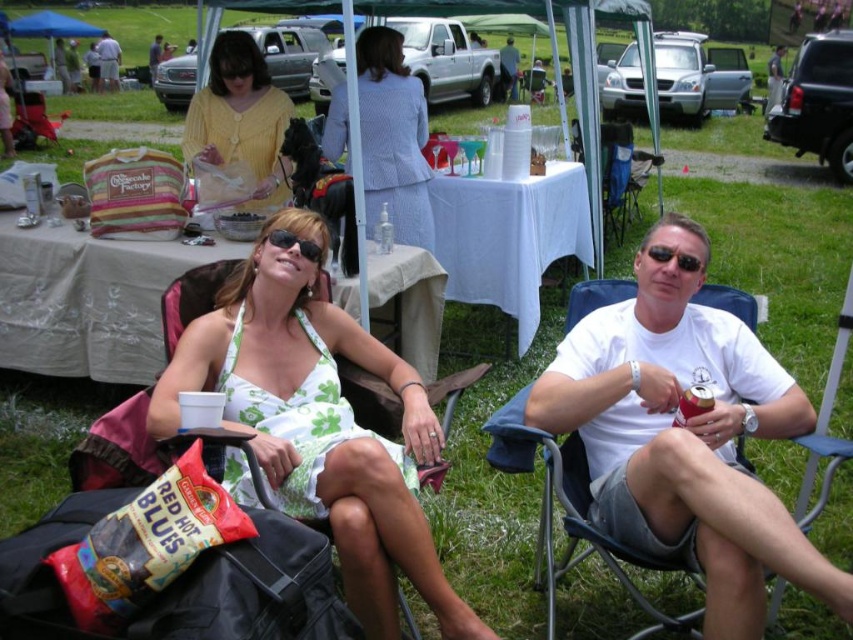
You are a photographer trying to capture a photo of the light blue textured suit at center and the matte white shirt at center. The camera you are using has a maximum focus range of 50 feet. Will both subjects be in focus?

The light blue textured suit at center is 55.57 feet from matte white shirt at center. Since the distance between them exceeds the camera maximum focus range of 50 feet, the camera cannot focus on both subjects simultaneously.

You are at the center of the image and want to move towards the light blue textured suit at center. Which direction should you move to reach it?

The light blue textured suit at center is already at the center of the image, so you don not need to move in any direction to reach it.